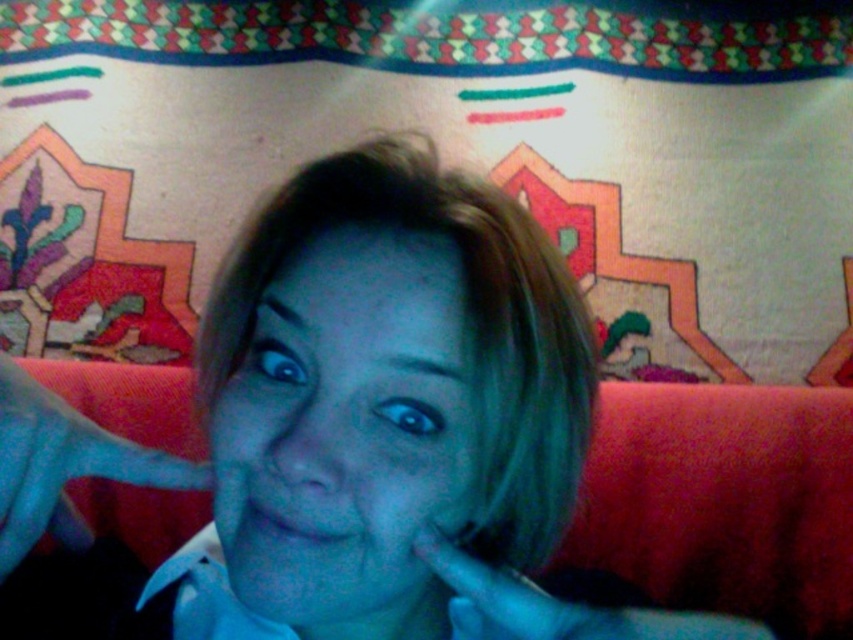
You are a photographer setting up a shot of the person in the scene. You need to place a small prop exactly halfway between point (184,483) and point (473,579). Will the prop be closer to the camera or further away from the camera compared to the person?

The prop placed halfway between point (184,483) and point (473,579) will be closer to the camera than the person because point (184,483) is closer to the camera than point (473,579). Since the prop is halfway, it will be at an intermediate distance between the two points, but still closer to the camera than the person.

You are an artist observing the scene and want to paint the hands accurately. Which hand should you paint first to ensure proper layering, the blue fabric hand at center or the smooth skin hand at lower right?

The blue fabric hand at center should be painted first because it is in front of the smooth skin hand at lower right, allowing the artist to layer the hands correctly.

You are a photographer setting up for a portrait. The subject has a matte blue face at center and a blue fabric hand at center. You need to ensure that the distance between them is at least 10 centimeters to avoid overcrowding the frame. Based on the scene description, is the current setup acceptable?

The matte blue face at center and blue fabric hand at center are 9.30 centimeters apart from each other, which is less than the required 10 centimeters. The current setup is overcrowded and needs adjustment to increase the distance between them.